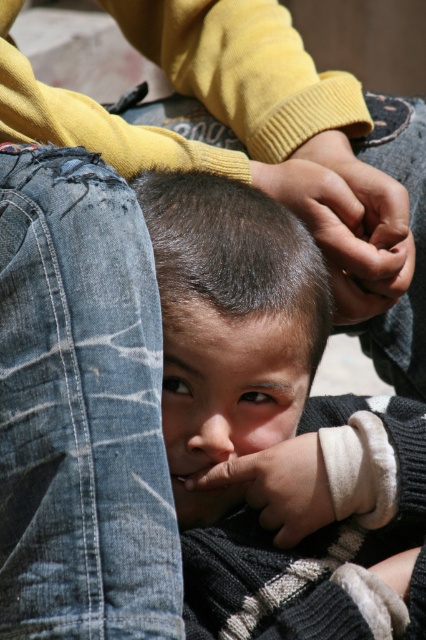
Question: Can you confirm if smooth skin child at center is wider than smooth skin forehead at center?

Choices:
 (A) yes
 (B) no

Answer: (A)

Question: Does smooth skin child at center lie behind smooth skin forehead at center?

Choices:
 (A) yes
 (B) no

Answer: (B)

Question: Among these points, which one is farthest from the camera?

Choices:
 (A) (276, 326)
 (B) (296, 348)
 (C) (356, 307)
 (D) (2, 150)

Answer: (C)

Question: Which point is farther to the camera?

Choices:
 (A) dark brown hair at center
 (B) smooth skin child at center
 (C) white soft hand at lower center

Answer: (C)

Question: Which point is closer to the camera taking this photo?

Choices:
 (A) (58, 497)
 (B) (319, 301)
 (C) (354, 572)
 (D) (279, 369)

Answer: (A)

Question: Does smooth skin child at center appear over dark skin/hands at center?

Choices:
 (A) no
 (B) yes

Answer: (A)